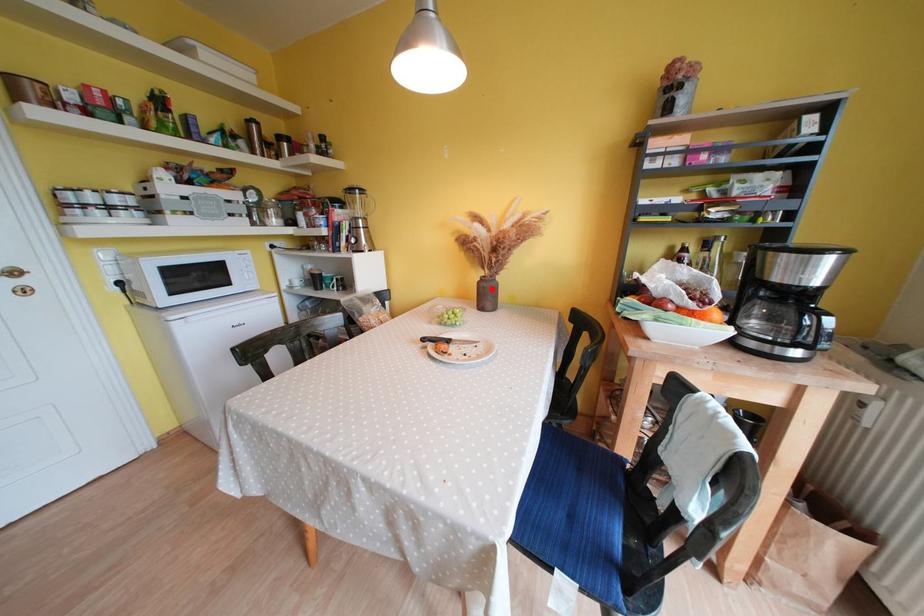
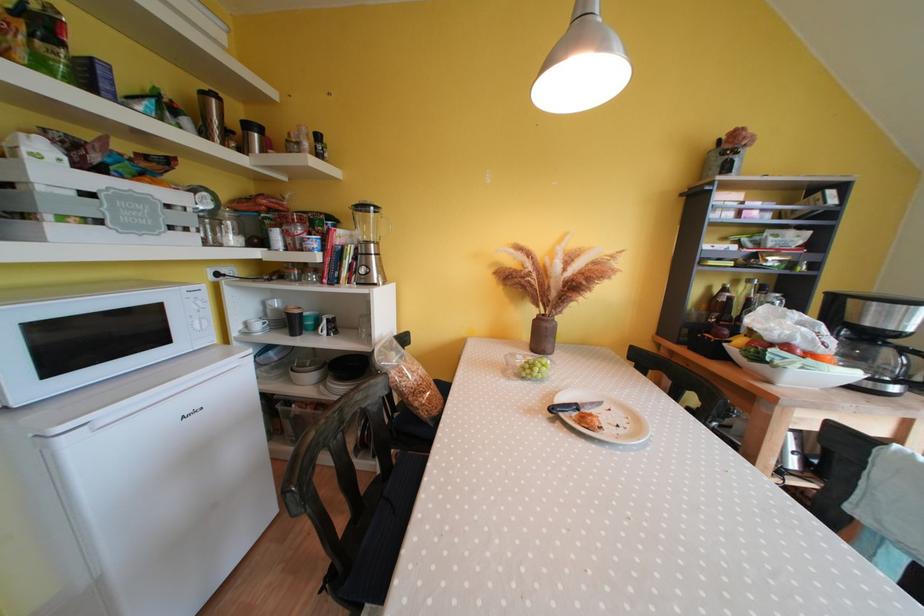
Locate, in the second image, the point that corresponds to the highlighted location in the first image.

(554, 330)